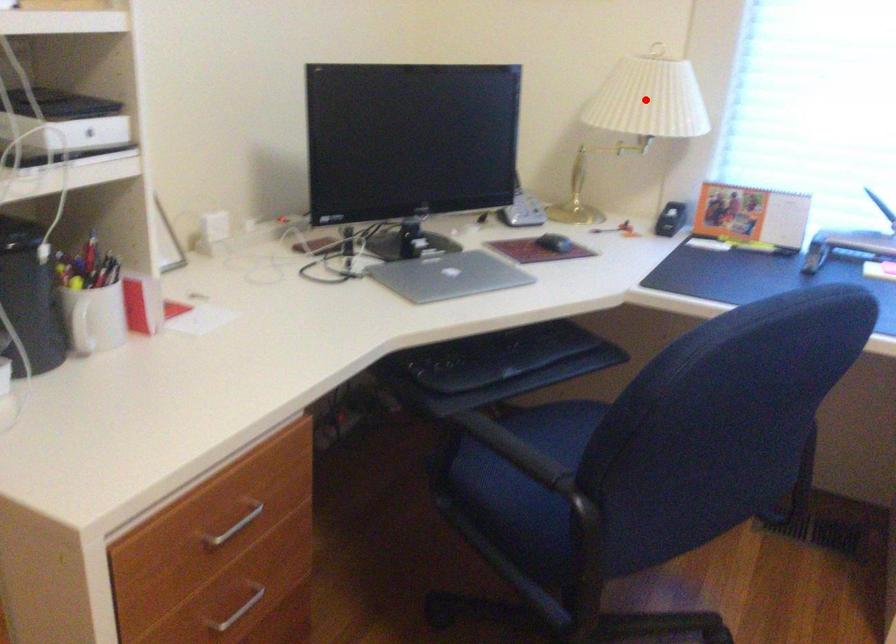
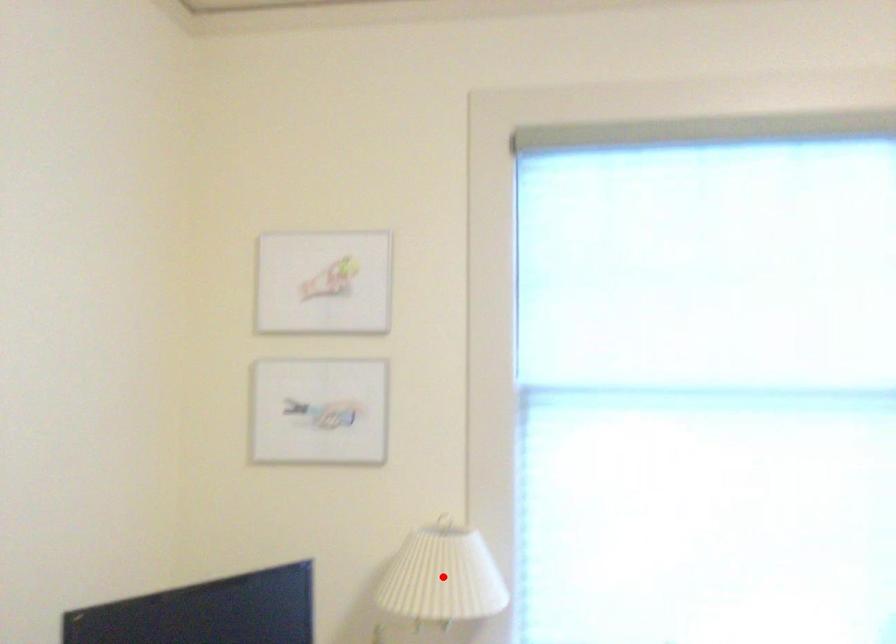
I am providing you with two images of the same scene from different viewpoints. A red point is marked on the first image and another point is marked on the second image. Is the red point in image1 aligned with the point shown in image2?

Yes